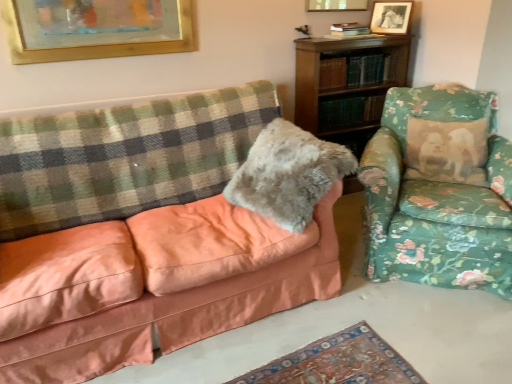
Question: Is the depth of fuzzy gray pillow at center less than that of gold-framed picture at upper center, the 3th picture frame when ordered from right to left?

Choices:
 (A) no
 (B) yes

Answer: (B)

Question: Does fuzzy gray pillow at center have a greater width compared to gold-framed picture at upper center, the 3th picture frame when ordered from right to left?

Choices:
 (A) yes
 (B) no

Answer: (A)

Question: Can you confirm if fuzzy gray pillow at center is bigger than gold-framed picture at upper center, the 3th picture frame when ordered from right to left?

Choices:
 (A) no
 (B) yes

Answer: (B)

Question: Is fuzzy gray pillow at center far from gold-framed picture at upper center, the first picture frame in the left-to-right sequence?

Choices:
 (A) no
 (B) yes

Answer: (B)

Question: Can we say fuzzy gray pillow at center lies outside gold-framed picture at upper center, the 3th picture frame when ordered from right to left?

Choices:
 (A) yes
 (B) no

Answer: (A)

Question: Would you say black glossy picture frame at upper right, placed as the 3th picture frame when sorted from left to right, is to the left or to the right of fuzzy gray pillow at center in the picture?

Choices:
 (A) left
 (B) right

Answer: (B)

Question: In the image, is black glossy picture frame at upper right, placed as the 1th picture frame when sorted from right to left, positioned in front of or behind fuzzy gray pillow at center?

Choices:
 (A) front
 (B) behind

Answer: (B)

Question: Looking at the image, does black glossy picture frame at upper right, placed as the 1th picture frame when sorted from right to left, seem bigger or smaller compared to fuzzy gray pillow at center?

Choices:
 (A) small
 (B) big

Answer: (A)

Question: Is black glossy picture frame at upper right, placed as the 3th picture frame when sorted from left to right, spatially inside fuzzy gray pillow at center, or outside of it?

Choices:
 (A) outside
 (B) inside

Answer: (A)

Question: From a real-world perspective, relative to matte peach couch at left, is fuzzy gray pillow at center vertically above or below?

Choices:
 (A) above
 (B) below

Answer: (A)

Question: From the image's perspective, relative to matte peach couch at left, is fuzzy gray pillow at center above or below?

Choices:
 (A) above
 (B) below

Answer: (A)

Question: From their relative heights in the image, would you say fuzzy gray pillow at center is taller or shorter than matte peach couch at left?

Choices:
 (A) tall
 (B) short

Answer: (B)

Question: Considering the positions of fuzzy gray pillow at center and matte peach couch at left in the image, is fuzzy gray pillow at center wider or thinner than matte peach couch at left?

Choices:
 (A) thin
 (B) wide

Answer: (A)

Question: From the image's perspective, is matte peach couch at left located above or below floral fabric armchair at right?

Choices:
 (A) below
 (B) above

Answer: (A)

Question: Is point (124, 249) closer or farther from the camera than point (425, 274)?

Choices:
 (A) farther
 (B) closer

Answer: (B)